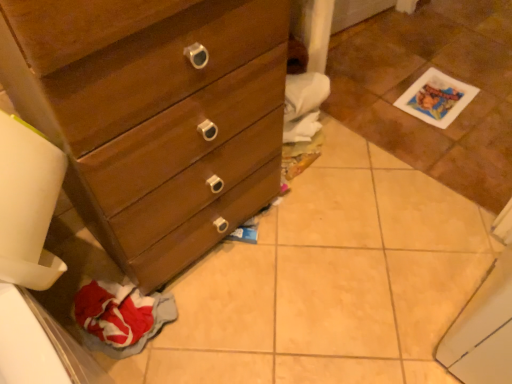
Question: Is white glossy tile at lower right inside the boundaries of matte wood chest of drawers at lower left, or outside?

Choices:
 (A) inside
 (B) outside

Answer: (B)

Question: Considering the positions of white glossy tile at lower right and matte wood chest of drawers at lower left in the image, is white glossy tile at lower right bigger or smaller than matte wood chest of drawers at lower left?

Choices:
 (A) big
 (B) small

Answer: (B)

Question: Is point (390, 142) positioned closer to the camera than point (40, 29)?

Choices:
 (A) closer
 (B) farther

Answer: (B)

Question: Looking at the image, does matte wood chest of drawers at lower left seem bigger or smaller compared to white glossy tile at lower right?

Choices:
 (A) big
 (B) small

Answer: (A)

Question: From a real-world perspective, is matte wood chest of drawers at lower left physically located above or below white glossy tile at lower right?

Choices:
 (A) above
 (B) below

Answer: (A)

Question: In terms of height, does matte wood chest of drawers at lower left look taller or shorter compared to white glossy tile at lower right?

Choices:
 (A) tall
 (B) short

Answer: (A)

Question: Is matte wood chest of drawers at lower left wider or thinner than white glossy tile at lower right?

Choices:
 (A) wide
 (B) thin

Answer: (B)